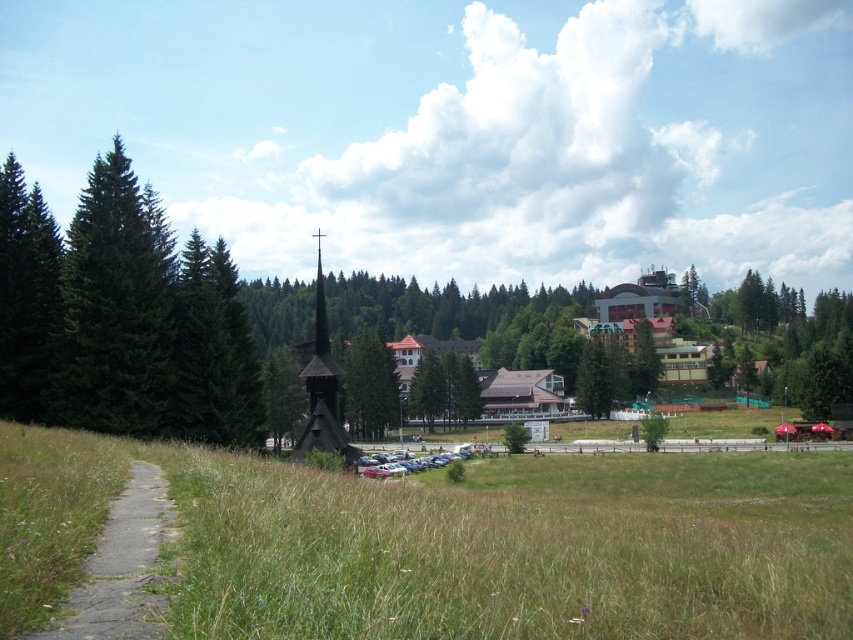
Is point (366, 387) farther from viewer compared to point (509, 422)?

No, it is in front of (509, 422).

Between green matte tree at center and green leafy tree at center, which one has more height?

With more height is green matte tree at center.

You are a GUI agent. You are given a task and a screenshot of the screen. Output one action in this format:
    pyautogui.click(x=<x>, y=<y>)
    Task: Click on the green matte tree at center
    Image resolution: width=853 pixels, height=640 pixels.
    Given the screenshot: What is the action you would take?
    pyautogui.click(x=369, y=387)

Does green matte tree at left have a lesser height compared to green matte tree at center?

Incorrect, green matte tree at left's height does not fall short of green matte tree at center's.

Which is in front, point (67, 385) or point (392, 387)?

Positioned in front is point (67, 385).

Identify the location of green matte tree at left. The image size is (853, 640). (115, 307).

Which of these two, gray concrete path at lower left or green leafy tree at center, stands taller?

green leafy tree at center

Find the location of `gray concrete path at lower left`. gray concrete path at lower left is located at coordinates pyautogui.click(x=120, y=564).

Which is in front, point (151, 557) or point (520, 429)?

Positioned in front is point (151, 557).

At what (x,y) coordinates should I click in order to perform the action: click on gray concrete path at lower left. Please return your answer as a coordinate pair (x, y). The height and width of the screenshot is (640, 853). Looking at the image, I should click on (120, 564).